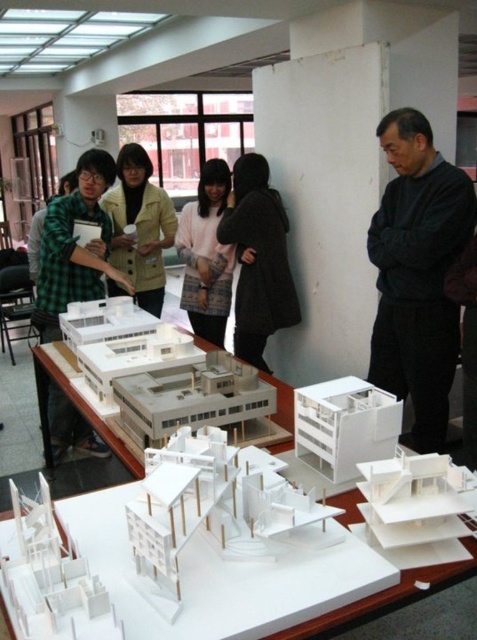
You are an attendee at the architectural presentation. You need to locate the green checkered shirt at left and the black matte jacket at upper right. From your perspective, which of these two is positioned more to the left?

The green checkered shirt at left is positioned more to the left than the black matte jacket at upper right.

You are an architect presenting your model to a client. You see the white paper model at center and the black matte coat at center. Which object is located to the left of the other?

The white paper model at center is positioned on the left side of black matte coat at center.